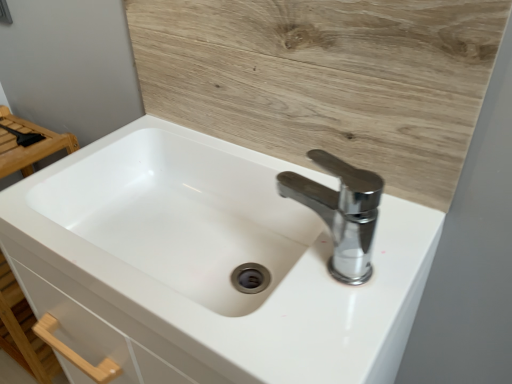
This screenshot has height=384, width=512. Identify the location of white glossy sink at center. (207, 265).

The width and height of the screenshot is (512, 384). In order to click on wooden at upper center in this screenshot , I will do `click(326, 79)`.

What do you see at coordinates (326, 79) in the screenshot?
I see `wooden at upper center` at bounding box center [326, 79].

Image resolution: width=512 pixels, height=384 pixels. What do you see at coordinates (341, 212) in the screenshot? I see `chrome metallic faucet at upper right` at bounding box center [341, 212].

Identify the location of white glossy sink at center. The height and width of the screenshot is (384, 512). (207, 265).

Consider the image. Who is taller, white glossy sink at center or chrome metallic faucet at upper right?

white glossy sink at center is taller.

Which of these two, white glossy sink at center or chrome metallic faucet at upper right, is thinner?

chrome metallic faucet at upper right is thinner.

Where is `sink below the chrome metallic faucet at upper right (from the image's perspective)`? The image size is (512, 384). sink below the chrome metallic faucet at upper right (from the image's perspective) is located at coordinates (207, 265).

Is white glossy sink at center facing away from chrome metallic faucet at upper right?

white glossy sink at center is not turned away from chrome metallic faucet at upper right.

Considering the positions of point (50, 250) and point (413, 186), is point (50, 250) closer or farther from the camera than point (413, 186)?

Point (50, 250) is positioned closer to the camera compared to point (413, 186).

From a real-world perspective, which object stands above the other?

In real-world perspective, wooden at upper center is above.

From the image's perspective, is white glossy sink at center below wooden at upper center?

Yes.

This screenshot has width=512, height=384. Find the location of `plywood behind the white glossy sink at center`. plywood behind the white glossy sink at center is located at coordinates (326, 79).

Is chrome metallic faucet at upper right positioned beyond the bounds of wooden at upper center?

Yes, chrome metallic faucet at upper right is outside of wooden at upper center.

Could you tell me if chrome metallic faucet at upper right is facing wooden at upper center?

No, chrome metallic faucet at upper right is not oriented towards wooden at upper center.

From a real-world perspective, is chrome metallic faucet at upper right over wooden at upper center?

Actually, chrome metallic faucet at upper right is physically below wooden at upper center in the real world.

Can you tell me how much chrome metallic faucet at upper right and wooden at upper center differ in facing direction?

90.4 degrees.

Image resolution: width=512 pixels, height=384 pixels. In order to click on tap below the wooden at upper center (from the image's perspective) in this screenshot , I will do `click(341, 212)`.

How different are the orientations of wooden at upper center and chrome metallic faucet at upper right in degrees?

The facing directions of wooden at upper center and chrome metallic faucet at upper right are 90.4 degrees apart.

Measure the distance between wooden at upper center and chrome metallic faucet at upper right.

The distance of wooden at upper center from chrome metallic faucet at upper right is 5.33 inches.

Is wooden at upper center to the left or to the right of chrome metallic faucet at upper right in the image?

Based on their positions, wooden at upper center is located to the left of chrome metallic faucet at upper right.

Is wooden at upper center looking in the opposite direction of white glossy sink at center?

No, wooden at upper center's orientation is not away from white glossy sink at center.

Between point (444, 160) and point (234, 310), which one is positioned in front?

The point (444, 160) is closer to the camera.

You are a GUI agent. You are given a task and a screenshot of the screen. Output one action in this format:
    pyautogui.click(x=<x>, y=<y>)
    Task: Click on the sink located underneath the wooden at upper center (from a real-world perspective)
    Image resolution: width=512 pixels, height=384 pixels.
    Given the screenshot: What is the action you would take?
    pyautogui.click(x=207, y=265)

The image size is (512, 384). Find the location of `tap behind the white glossy sink at center`. tap behind the white glossy sink at center is located at coordinates click(341, 212).

From a real-world perspective, which is physically above, chrome metallic faucet at upper right or white glossy sink at center?

From a 3D spatial view, chrome metallic faucet at upper right is above.

Can you confirm if chrome metallic faucet at upper right is shorter than white glossy sink at center?

Correct, chrome metallic faucet at upper right is not as tall as white glossy sink at center.

Which object is positioned more to the right, chrome metallic faucet at upper right or white glossy sink at center?

From the viewer's perspective, chrome metallic faucet at upper right appears more on the right side.

In the image, there is a white glossy sink at center. In order to click on tap above it (from the image's perspective) in this screenshot , I will do point(341,212).

The image size is (512, 384). Find the location of `plywood behind the white glossy sink at center`. plywood behind the white glossy sink at center is located at coordinates (326, 79).

Which object lies further to the anchor point wooden at upper center, white glossy sink at center or chrome metallic faucet at upper right?

white glossy sink at center is further to wooden at upper center.

Which object lies further to the anchor point white glossy sink at center, chrome metallic faucet at upper right or wooden at upper center?

Answer: Among the two, wooden at upper center is located further to white glossy sink at center.

From the image, which object appears to be farther from chrome metallic faucet at upper right, wooden at upper center or white glossy sink at center?

Based on the image, white glossy sink at center appears to be further to chrome metallic faucet at upper right.

When comparing their distances from chrome metallic faucet at upper right, does white glossy sink at center or wooden at upper center seem further?

white glossy sink at center lies further to chrome metallic faucet at upper right than the other object.

Which object lies further to the anchor point wooden at upper center, chrome metallic faucet at upper right or white glossy sink at center?

white glossy sink at center lies further to wooden at upper center than the other object.

Consider the image. Estimate the real-world distances between objects in this image. Which object is further from white glossy sink at center, wooden at upper center or chrome metallic faucet at upper right?

Based on the image, wooden at upper center appears to be further to white glossy sink at center.

The width and height of the screenshot is (512, 384). I want to click on tap between wooden at upper center and white glossy sink at center in the vertical direction, so click(341, 212).